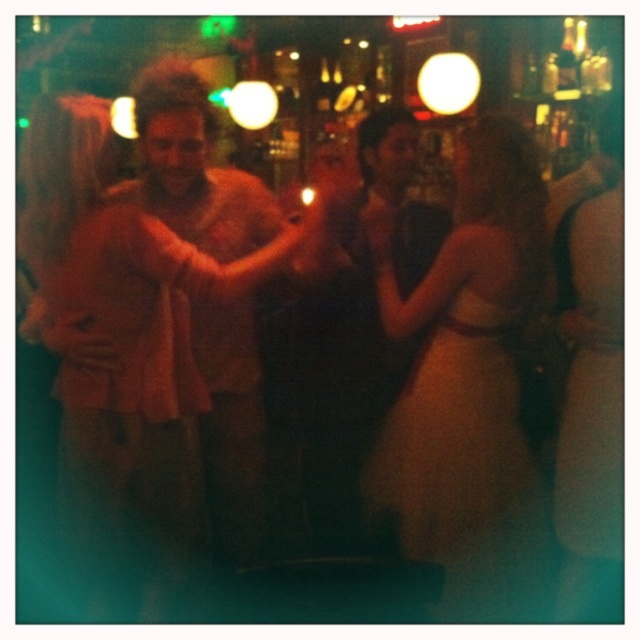
You are a fashion designer observing a photo shoot at a bar. You notice two items of clothing in the image. The first is the silky beige dress at center, and the second is the light brown leather jacket at center. Based on the description provided, which clothing item takes up more space in the image?

The silky beige dress at center is bigger than the light brown leather jacket at center, so the silky beige dress at center takes up more space in the image.

You are at a party and want to take a photo of the matte beige dress at center and the light brown leather jacket at center. Which one should you focus on first if you want to capture both in the same frame?

The matte beige dress at center is not as tall as the light brown leather jacket at center, so you should focus on the light brown leather jacket at center first to ensure both are in focus.

You are a photographer positioned at the camera. You want to capture a closeup shot of the silky beige dress at center. Given that your camera can focus on objects within 5 feet, will you be able to take the closeup without moving closer?

The silky beige dress at center is 7.28 feet away from the camera. Since the camera can only focus within 5 feet, you will need to move closer to take the closeup.